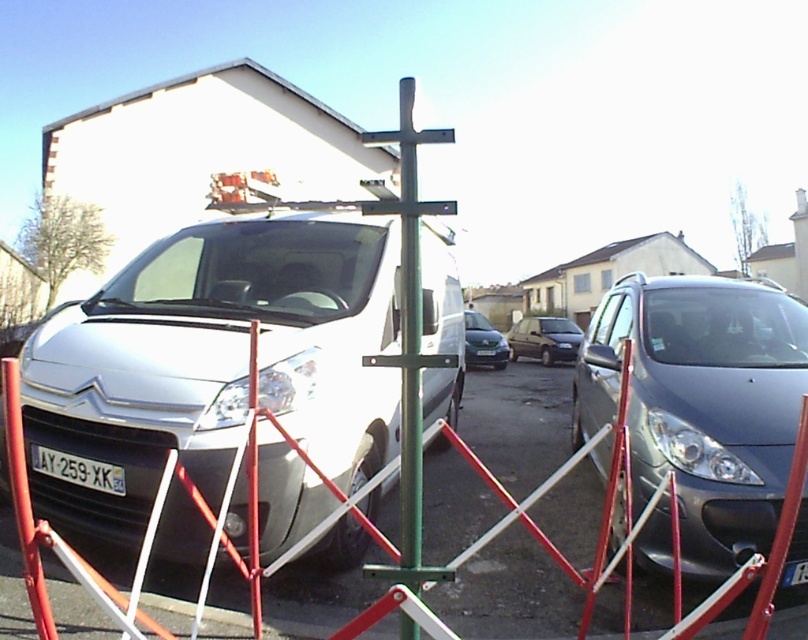
You are a delivery driver who needs to park your truck in the parking area shown. You see the metallic gray minivan at right and the black plastic license plate at lower left. Which object is bigger in size?

The metallic gray minivan at right is larger in size compared to the black plastic license plate at lower left.

You are a delivery driver who needs to park your vehicle in the parking area shown. You see the green metallic cross at center and the silver metallic hatchback at center. Which object takes up more space horizontally in the image?

The silver metallic hatchback at center takes up more space horizontally than the green metallic cross at center because the green metallic cross at center has a lesser width compared to the silver metallic hatchback at center.

You are a delivery driver who needs to park your van in the parking area. You see the silver metallic van at left and the black plastic license plate at lower left. Which vehicle is positioned to the right of the other?

The silver metallic van at left is to the right of the black plastic license plate at lower left.